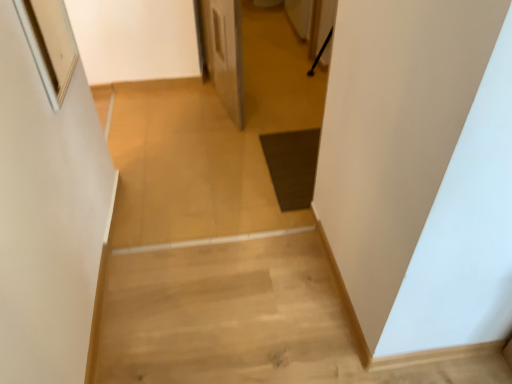
Where is `free space to the right of wooden door at center`? The width and height of the screenshot is (512, 384). free space to the right of wooden door at center is located at coordinates (282, 97).